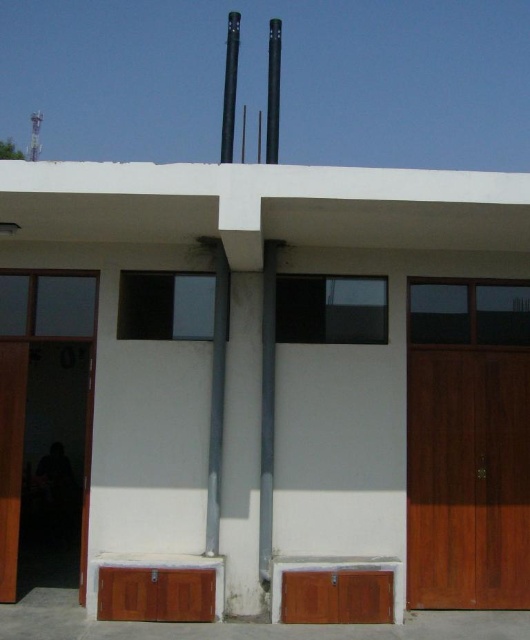
Can you confirm if wooden door at right is thinner than wooden door at left?

In fact, wooden door at right might be wider than wooden door at left.

Who is higher up, wooden door at right or wooden door at left?

Positioned higher is wooden door at left.

Is point (496, 480) less distant than point (3, 468)?

No, it is behind (3, 468).

Find the location of a particular element. This screenshot has height=640, width=530. wooden door at right is located at coordinates (467, 477).